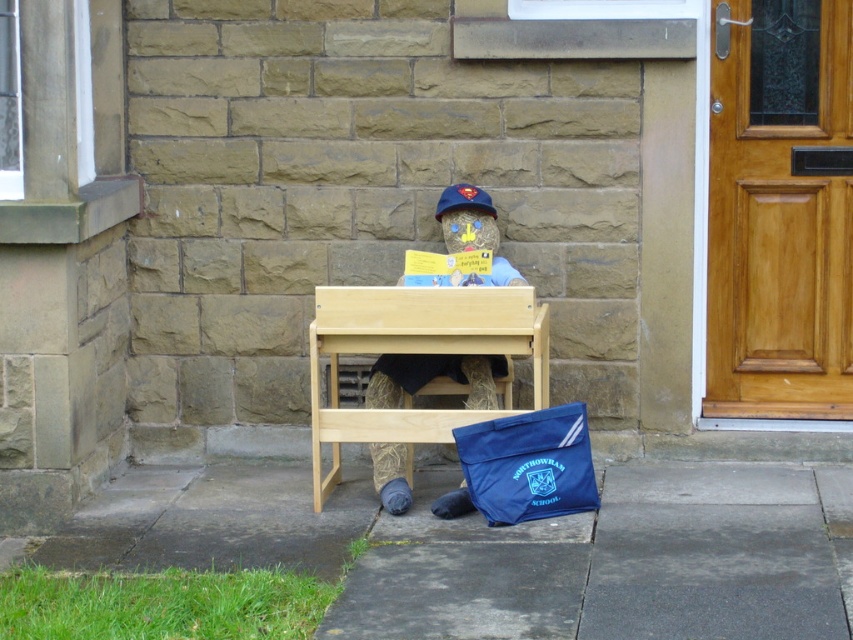
Which of these two, natural wood table at center or blue fabric baseball hat at center, stands taller?

Standing taller between the two is natural wood table at center.

Is the position of natural wood table at center less distant than that of blue fabric baseball hat at center?

Yes, it is.

Which is behind, point (463, 326) or point (448, 209)?

Positioned behind is point (448, 209).

This screenshot has height=640, width=853. What are the coordinates of `natural wood table at center` in the screenshot? It's located at (416, 353).

Is point (321, 406) more distant than point (561, 426)?

Yes, it is behind point (561, 426).

Can you confirm if natural wood table at center is positioned to the right of blue fabric bag at lower center?

No, natural wood table at center is not to the right of blue fabric bag at lower center.

Image resolution: width=853 pixels, height=640 pixels. In order to click on natural wood table at center in this screenshot , I will do 416,353.

This screenshot has width=853, height=640. Identify the location of natural wood table at center. (416, 353).

Which is above, smooth concrete pavement at lower center or natural wood table at center?

natural wood table at center

Can you confirm if smooth concrete pavement at lower center is wider than natural wood table at center?

Indeed, smooth concrete pavement at lower center has a greater width compared to natural wood table at center.

Is point (675, 504) farther from viewer compared to point (521, 291)?

Yes.

Find the location of `smooth concrete pavement at lower center`. smooth concrete pavement at lower center is located at coordinates (505, 550).